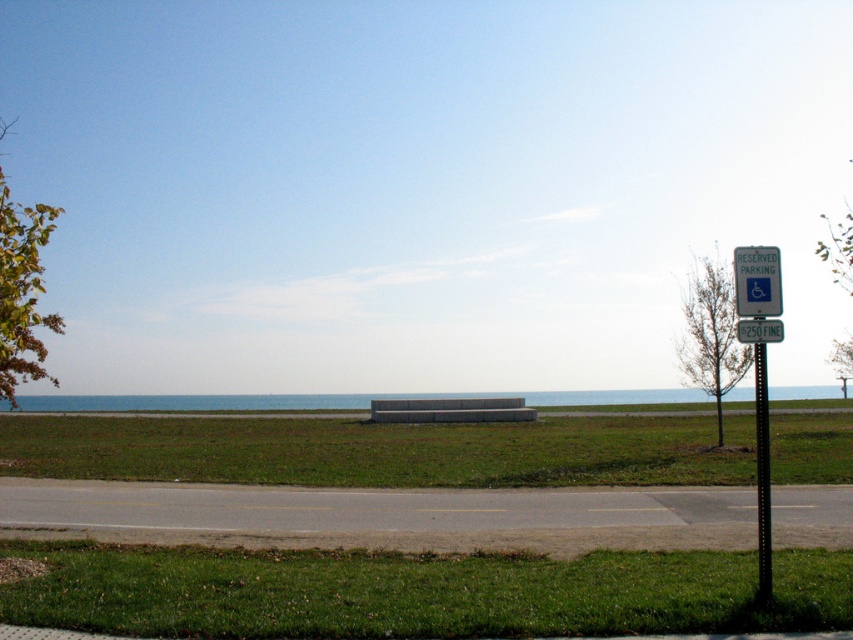
What do you see at coordinates (22, 291) in the screenshot? I see `green leafy tree at left` at bounding box center [22, 291].

Does green leafy tree at left have a lesser width compared to green leafy tree at right?

In fact, green leafy tree at left might be wider than green leafy tree at right.

Is point (53, 214) less distant than point (717, 285)?

Yes, it is in front of point (717, 285).

At what (x,y) coordinates should I click in order to perform the action: click on green leafy tree at left. Please return your answer as a coordinate pair (x, y). The width and height of the screenshot is (853, 640). Looking at the image, I should click on (22, 291).

Is green leafy tree at right behind black metal pole at right?

Yes, it is behind black metal pole at right.

Is green leafy tree at right closer to the viewer compared to black metal pole at right?

No, green leafy tree at right is further to the viewer.

Is point (712, 289) positioned behind point (763, 544)?

Yes, point (712, 289) is farther from viewer.

Identify the location of green leafy tree at right. 711,333.

Is point (526, 554) closer to camera compared to point (759, 563)?

No, it is behind (759, 563).

Does green grass at lower center appear on the right side of black metal pole at right?

No, green grass at lower center is not to the right of black metal pole at right.

Is point (62, 605) positioned behind point (758, 500)?

No, it is in front of (758, 500).

Locate an element on the screen. green grass at lower center is located at coordinates (418, 592).